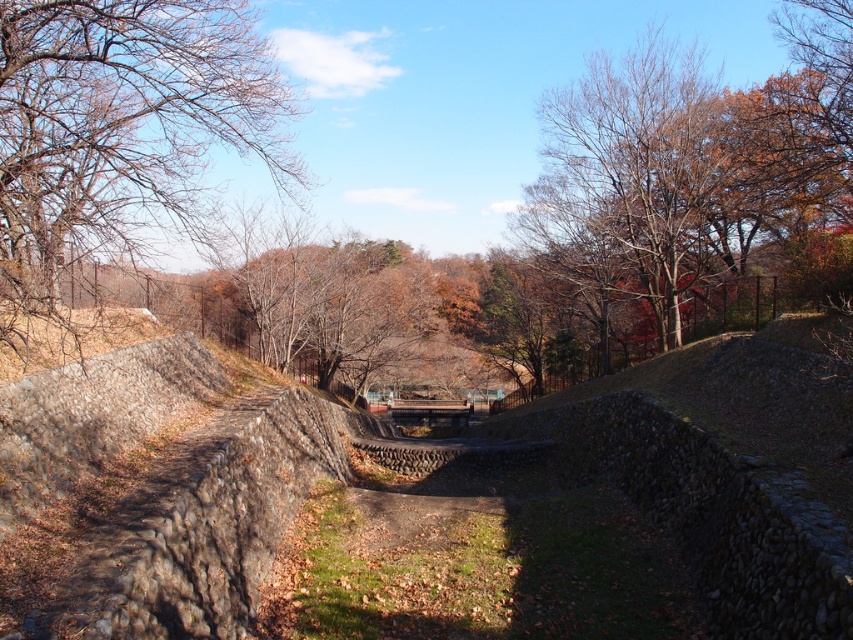
You are a hiker planning to take a photo of the bare branches at upper left and the rough stone mound at center from a position along the stone pathway. Which object will appear larger in your photo?

The bare branches at upper left will appear larger in the photo because they are much taller than the rough stone mound at center.

You are a hiker walking along the stone pathway in the autumn scene. You notice the bare branches at upper left and the rough stone mound at center. Which object is closer to you as you walk along the path?

The bare branches at upper left are closer to you because the rough stone mound at center is positioned behind them.